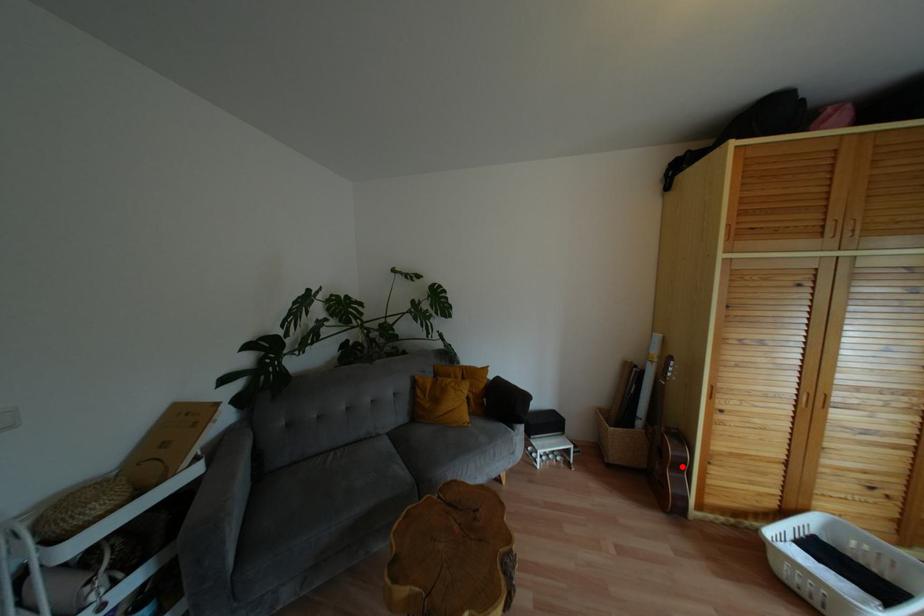
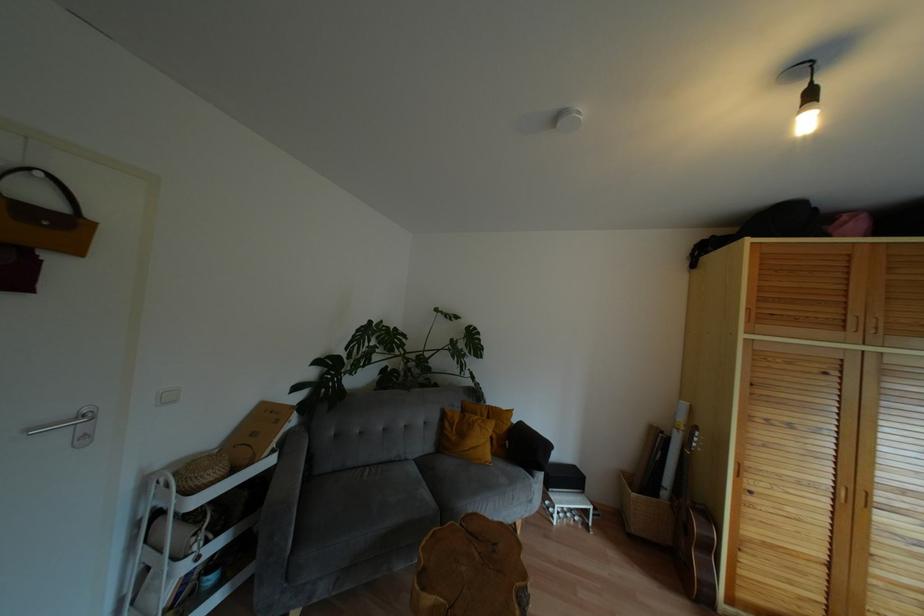
Question: A red point is marked in image1. In image2, is the corresponding 3D point closer to the camera or farther? Reply with the corresponding letter.

Choices:
 (A) The corresponding 3D point is closer.
 (B) The corresponding 3D point is farther.

Answer: (A)